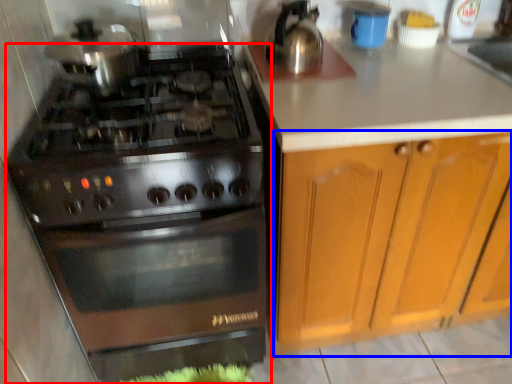
Question: Which object appears closest to the camera in this image, gas stove (highlighted by a red box) or cabinetry (highlighted by a blue box)?

Choices:
 (A) gas stove
 (B) cabinetry

Answer: (A)